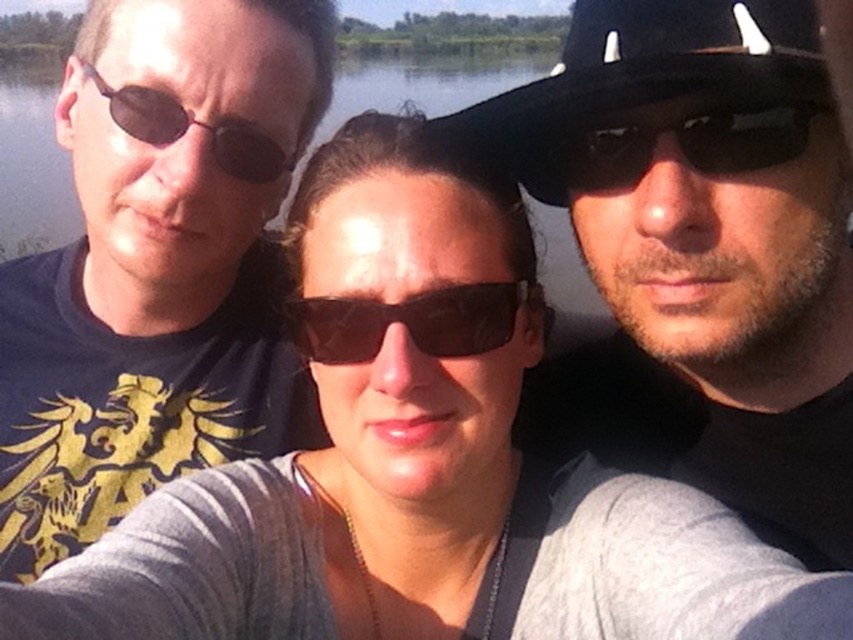
Question: Which point is closer to the camera taking this photo?

Choices:
 (A) (223, 141)
 (B) (144, 458)

Answer: (A)

Question: Which of the following is the closest to the observer?

Choices:
 (A) matte black sunglasses at left
 (B) black matte sunglasses at right
 (C) black matte baseball hat at right
 (D) black matte sunglasses at center

Answer: (C)

Question: Does clear water at upper left appear under black matte sunglasses at center?

Choices:
 (A) yes
 (B) no

Answer: (B)

Question: Considering the relative positions of clear water at upper left and black matte sunglasses at center in the image provided, where is clear water at upper left located with respect to black matte sunglasses at center?

Choices:
 (A) above
 (B) below

Answer: (A)

Question: Which point appears closest to the camera in this image?

Choices:
 (A) (227, 17)
 (B) (631, 177)
 (C) (428, 100)

Answer: (B)

Question: Can you confirm if matte black hat at upper right is positioned above black matte sunglasses at center?

Choices:
 (A) yes
 (B) no

Answer: (A)